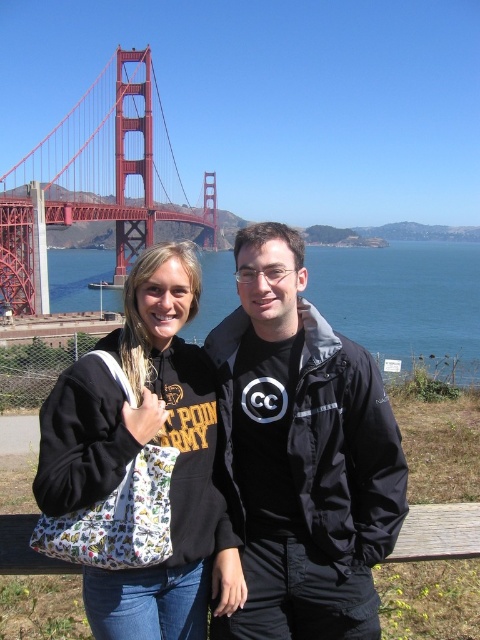
Between black matte jacket at center and blue water at center, which one has less height?

black matte jacket at center is shorter.

Does black matte jacket at center have a greater width compared to blue water at center?

In fact, black matte jacket at center might be narrower than blue water at center.

Is point (245, 324) positioned after point (409, 362)?

No, it is not.

This screenshot has height=640, width=480. In order to click on black matte jacket at center in this screenshot , I will do `click(302, 452)`.

Who is lower down, red painted steel bridge at upper left or blue water at center?

blue water at center is lower down.

What are the coordinates of `red painted steel bridge at upper left` in the screenshot? It's located at (97, 179).

Where is `red painted steel bridge at upper left`? red painted steel bridge at upper left is located at coordinates (97, 179).

From the picture: Is black matte jacket at center to the right of printed fabric tote bag at center from the viewer's perspective?

Yes, black matte jacket at center is to the right of printed fabric tote bag at center.

Find the location of a particular element. black matte jacket at center is located at coordinates (302, 452).